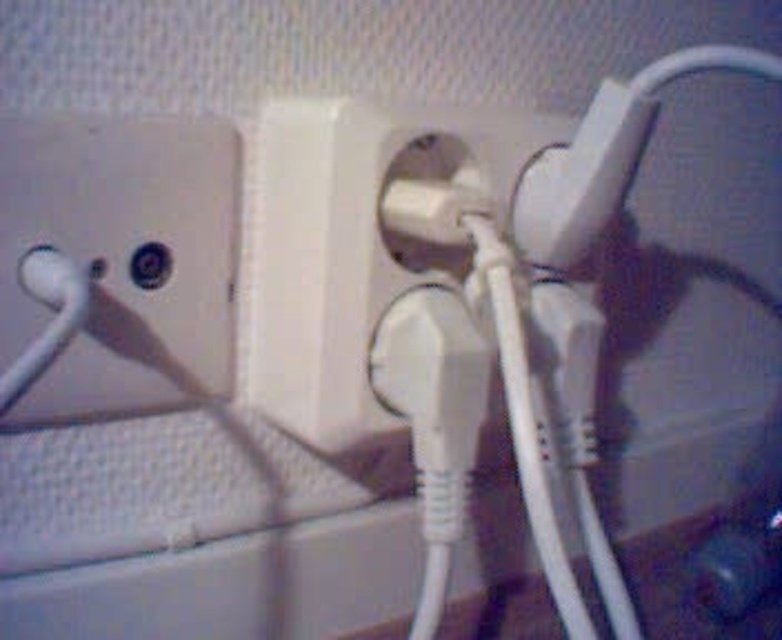
Question: Is white plastic outlet at upper left wider than white plastic outlet at center?

Choices:
 (A) no
 (B) yes

Answer: (A)

Question: Observing the image, what is the correct spatial positioning of white plastic outlet at upper left in reference to white plastic outlet at center?

Choices:
 (A) above
 (B) below

Answer: (B)

Question: Which point is closer to the camera taking this photo?

Choices:
 (A) (163, 134)
 (B) (282, 205)

Answer: (A)

Question: Which object appears farthest from the camera in this image?

Choices:
 (A) white plastic outlet at upper left
 (B) white plastic outlet at center

Answer: (B)

Question: Which object appears closest to the camera in this image?

Choices:
 (A) white plastic outlet at upper left
 (B) white plastic outlet at center

Answer: (A)

Question: Is white plastic outlet at upper left smaller than white plastic outlet at center?

Choices:
 (A) no
 (B) yes

Answer: (B)